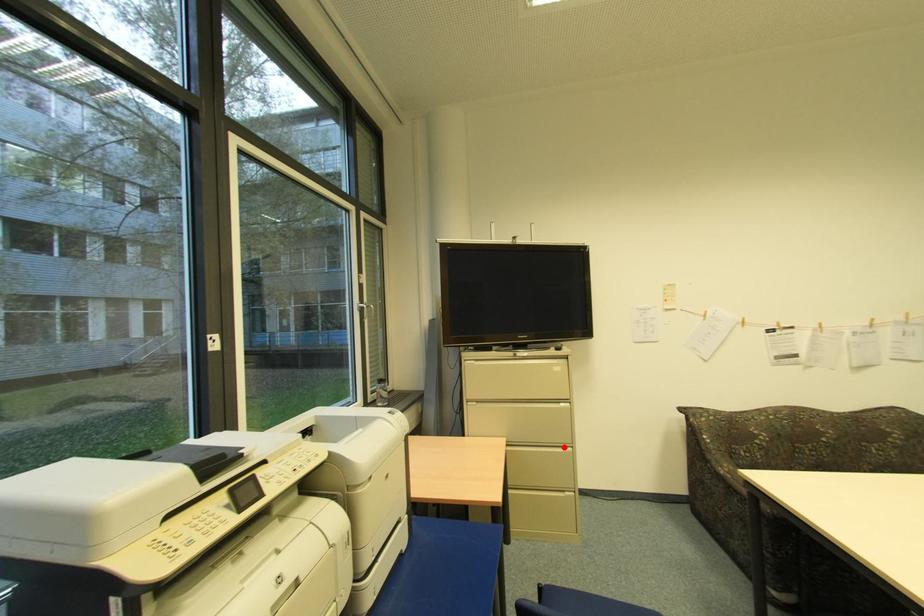
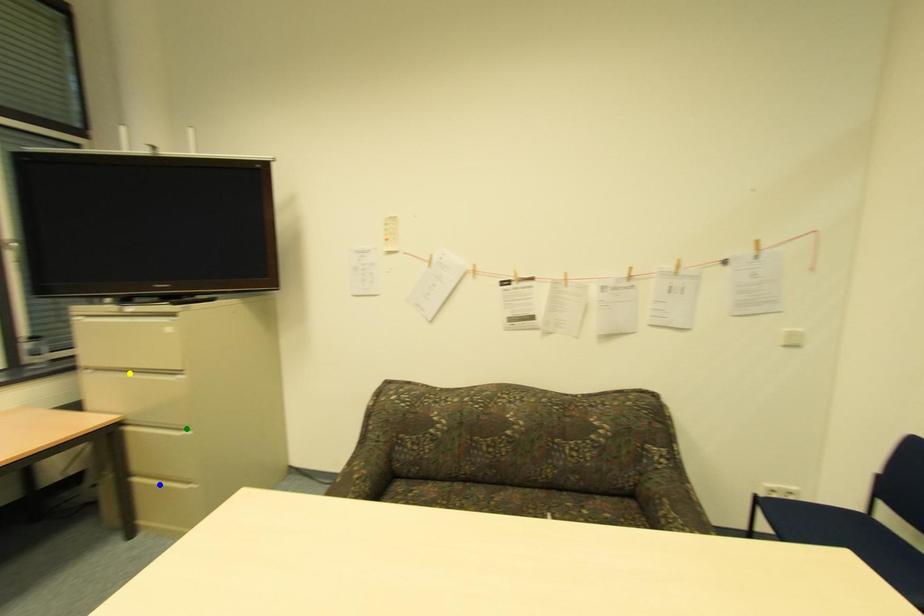
Question: I am providing you with two images of the same scene from different viewpoints. A red point is marked on the first image. You are given multiple points on the second image. In image 2, which mark is for the same physical point as the one in image 1?

Choices:
 (A) yellow point
 (B) blue point
 (C) green point

Answer: (C)